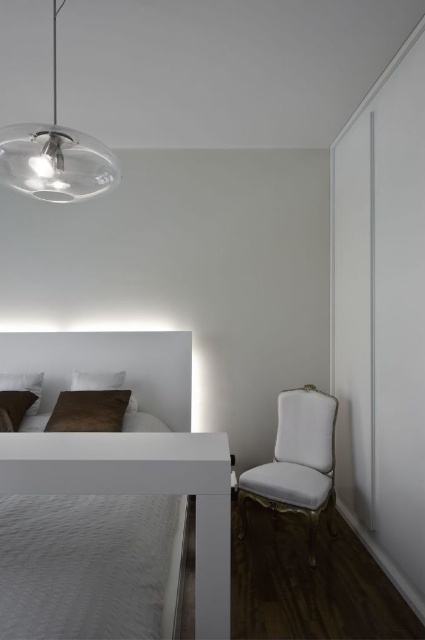
This screenshot has width=425, height=640. Describe the element at coordinates (129, 442) in the screenshot. I see `white glossy bed at center` at that location.

Is point (82, 435) more distant than point (78, 385)?

No, (82, 435) is in front of (78, 385).

Is point (124, 360) less distant than point (119, 371)?

No, it is behind (119, 371).

This screenshot has height=640, width=425. Find the location of `white glossy bed at center`. white glossy bed at center is located at coordinates (129, 442).

Which of these two, brown suede pillow at lower left or white soft pillow at upper left, stands shorter?

brown suede pillow at lower left

Does brown suede pillow at lower left appear on the left side of white soft pillow at upper left?

Correct, you'll find brown suede pillow at lower left to the left of white soft pillow at upper left.

Who is more distant from viewer, [99,408] or [87,387]?

Positioned behind is point [87,387].

Where is `brown suede pillow at lower left`? The width and height of the screenshot is (425, 640). brown suede pillow at lower left is located at coordinates (88, 412).

Who is taller, velvet brown pillow at lower left or white soft pillow at lower left?

white soft pillow at lower left

Is point (14, 424) in front of point (5, 380)?

Yes, point (14, 424) is in front of point (5, 380).

Locate an element on the screen. velvet brown pillow at lower left is located at coordinates (14, 408).